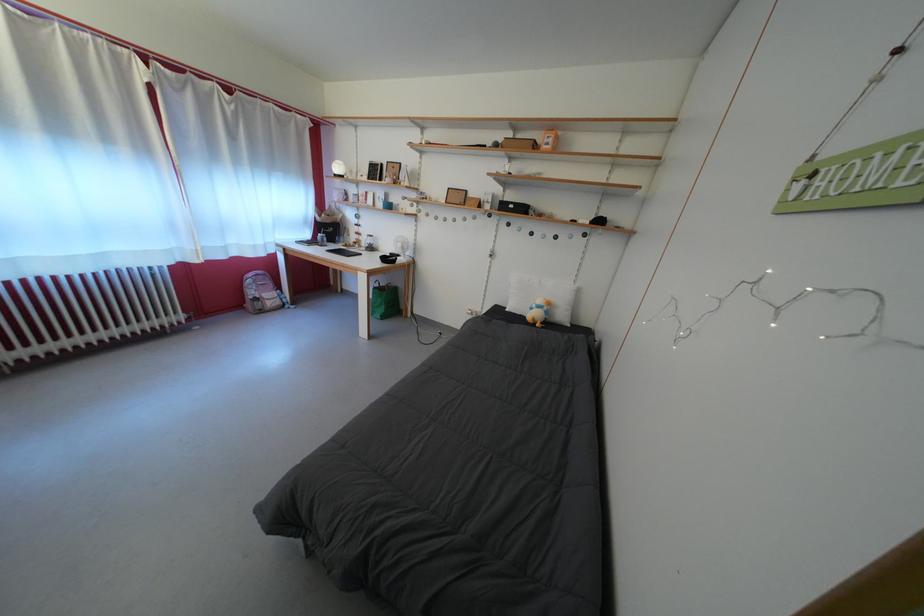
At what (x,y) coordinates should I click in order to perform the action: click on white mug. Please return your answer as a coordinate pair (x, y). Looking at the image, I should click on (370, 243).